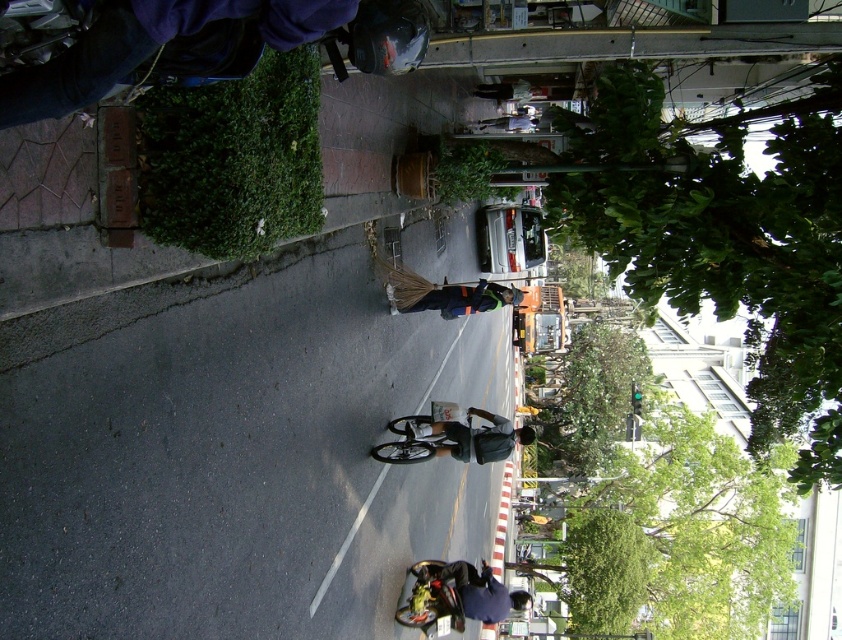
What is located at the point with coordinates (x=457, y=298) in the image?

The point at coordinates (x=457, y=298) marks the location of the dark blue uniform at center.

What is the 2D coordinate of the dark gray fabric jacket at center in the image?

The dark gray fabric jacket at center is located at the 2D coordinate point of (464,436).